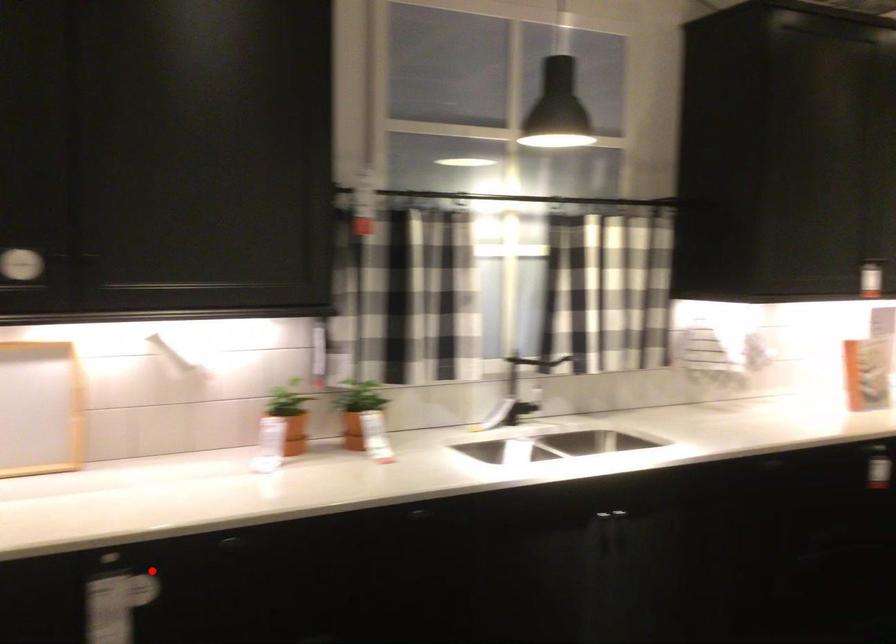
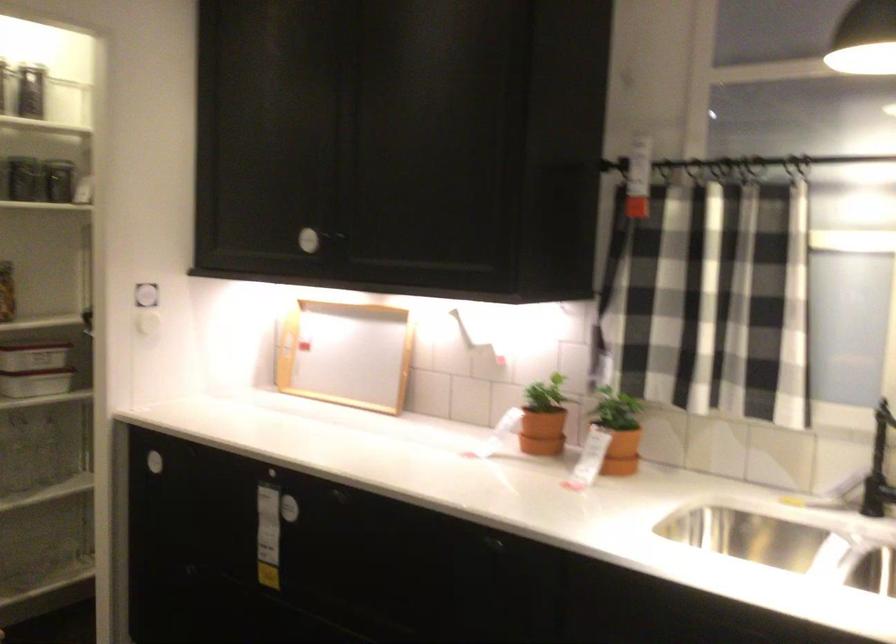
Question: I am providing you with two images of the same scene from different viewpoints. Image1 has a red point marked. In image2, the corresponding 3D location appears at what relative position? Reply with the corresponding letter.

Choices:
 (A) Closer
 (B) Farther

Answer: (B)